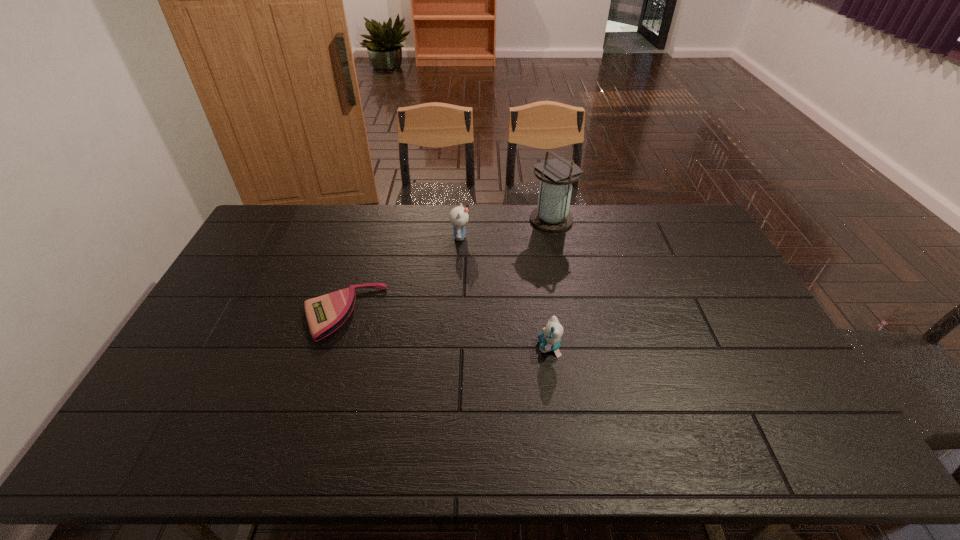
You are a GUI agent. You are given a task and a screenshot of the screen. Output one action in this format:
    pyautogui.click(x=<x>, y=<y>)
    Task: Click on the lantern
    This screenshot has height=540, width=960.
    Given the screenshot: What is the action you would take?
    pyautogui.click(x=552, y=214)

What are the coordinates of `the third object from right to left` in the screenshot? It's located at (458, 217).

In order to click on the taller kitten in this screenshot , I will do `click(458, 217)`.

Image resolution: width=960 pixels, height=540 pixels. In order to click on the nearer kitten in this screenshot , I will do pos(550,340).

The height and width of the screenshot is (540, 960). What are the coordinates of `the shorter kitten` in the screenshot? It's located at (550, 340).

Where is `the shortest object`? This screenshot has height=540, width=960. the shortest object is located at coordinates (325, 314).

Locate an element on the screen. Image resolution: width=960 pixels, height=540 pixels. wristlet is located at coordinates point(325,314).

You are a GUI agent. You are given a task and a screenshot of the screen. Output one action in this format:
    pyautogui.click(x=<x>, y=<y>)
    Task: Click on the vacant space located 0.280m on the left of the tallest object
    The height and width of the screenshot is (540, 960).
    Given the screenshot: What is the action you would take?
    pyautogui.click(x=455, y=220)

The image size is (960, 540). I want to click on vacant space located 0.230m on the front-facing side of the left kitten, so click(x=533, y=237).

Locate an element on the screen. The image size is (960, 540). blank area located on the face of the shorter kitten is located at coordinates (473, 347).